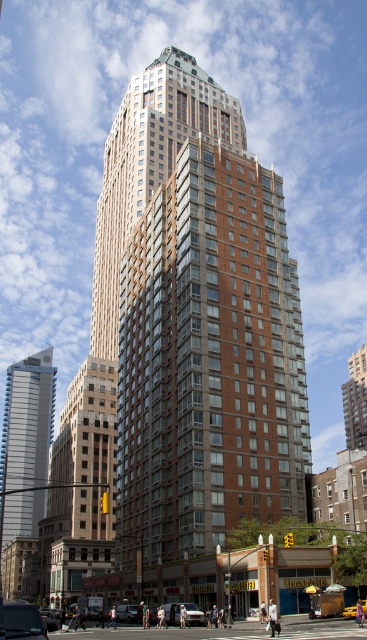
Is silver metallic car at lower center to the right of yellow matte taxi cab at center from the viewer's perspective?

In fact, silver metallic car at lower center is to the left of yellow matte taxi cab at center.

Who is more distant from viewer, (175, 620) or (365, 608)?

Positioned behind is point (175, 620).

Locate an element on the screen. silver metallic car at lower center is located at coordinates (179, 612).

Can you confirm if brown brick building at center is bigger than metallic silver car at center?

Indeed, brown brick building at center has a larger size compared to metallic silver car at center.

You are a GUI agent. You are given a task and a screenshot of the screen. Output one action in this format:
    pyautogui.click(x=<x>, y=<y>)
    Task: Click on the brown brick building at center
    This screenshot has width=367, height=640.
    Given the screenshot: What is the action you would take?
    pyautogui.click(x=355, y=400)

Who is more distant from viewer, (361, 365) or (131, 612)?

The point (361, 365) is more distant.

At what (x,y) coordinates should I click in order to perform the action: click on brown brick building at center. Please return your answer as a coordinate pair (x, y). Image resolution: width=367 pixels, height=640 pixels. Looking at the image, I should click on (355, 400).

This screenshot has height=640, width=367. In order to click on silver metallic skyscraper at left in this screenshot , I will do `click(27, 420)`.

Is silver metallic skyscraper at left below brown brick building at center?

Yes.

Is point (30, 394) positioned behind point (347, 445)?

No.

This screenshot has width=367, height=640. I want to click on silver metallic skyscraper at left, so click(x=27, y=420).